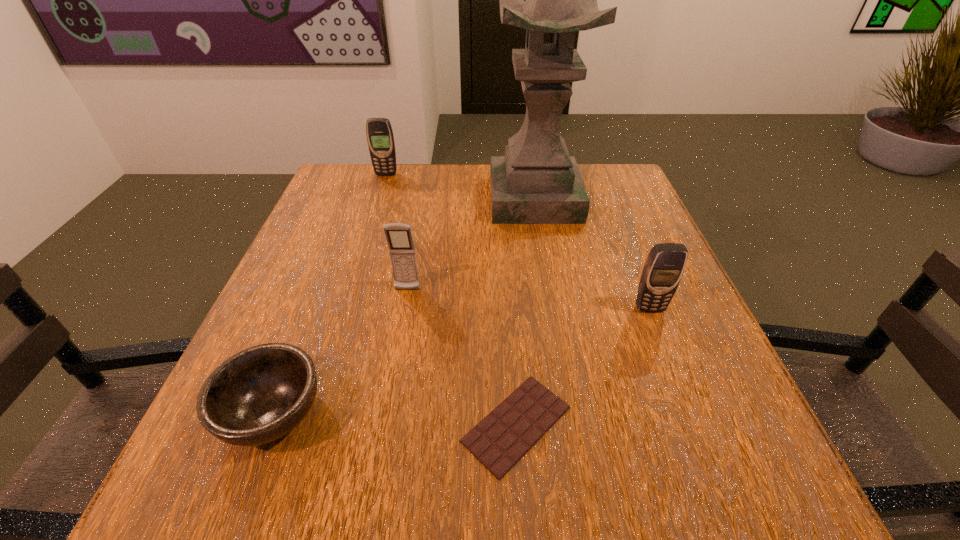
This screenshot has width=960, height=540. In order to click on vacant space at the far left corner in this screenshot , I will do `click(382, 193)`.

This screenshot has height=540, width=960. In order to click on vacant space at the near left corner in this screenshot , I will do `click(295, 478)`.

The height and width of the screenshot is (540, 960). I want to click on vacant space at the far right corner of the desktop, so click(591, 191).

You are a GUI agent. You are given a task and a screenshot of the screen. Output one action in this format:
    pyautogui.click(x=<x>, y=<y>)
    Task: Click on the free space that is in between the chocolate bar and the second cellular telephone from left to right
    
    Given the screenshot: What is the action you would take?
    pyautogui.click(x=462, y=357)

Locate an element on the screen. The height and width of the screenshot is (540, 960). free space between the rightmost cellular telephone and the shortest object is located at coordinates (583, 366).

What are the coordinates of `empty space between the farthest cellular telephone and the rightmost cellular telephone` in the screenshot? It's located at (517, 241).

Where is `vacant area between the shortest object and the third object from left to right`? The height and width of the screenshot is (540, 960). vacant area between the shortest object and the third object from left to right is located at coordinates (462, 357).

I want to click on vacant space that is in between the second shortest object and the third farthest object, so click(340, 352).

Identify the location of unoccupied area between the nearest cellular telephone and the shortest object. tap(583, 366).

At what (x,y) coordinates should I click in order to perform the action: click on vacant point located between the chocolate bar and the second shortest object. Please return your answer as a coordinate pair (x, y). This screenshot has width=960, height=540. Looking at the image, I should click on (395, 418).